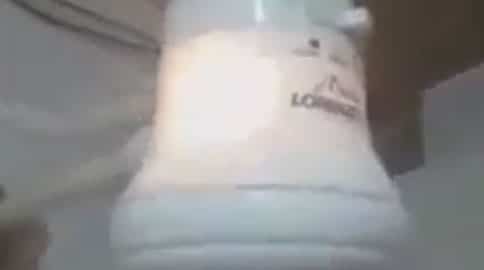
Locate an element on the screen. The width and height of the screenshot is (484, 270). switch is located at coordinates (362, 24).